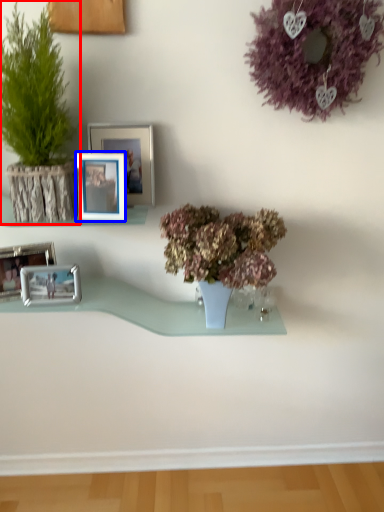
Question: Which object appears closest to the camera in this image, houseplant (highlighted by a red box) or picture frame (highlighted by a blue box)?

Choices:
 (A) houseplant
 (B) picture frame

Answer: (A)